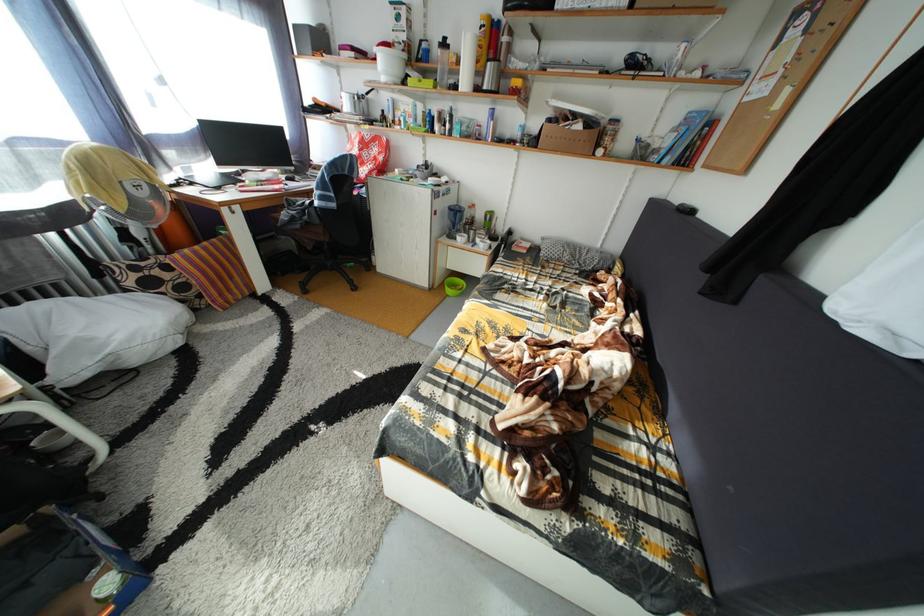
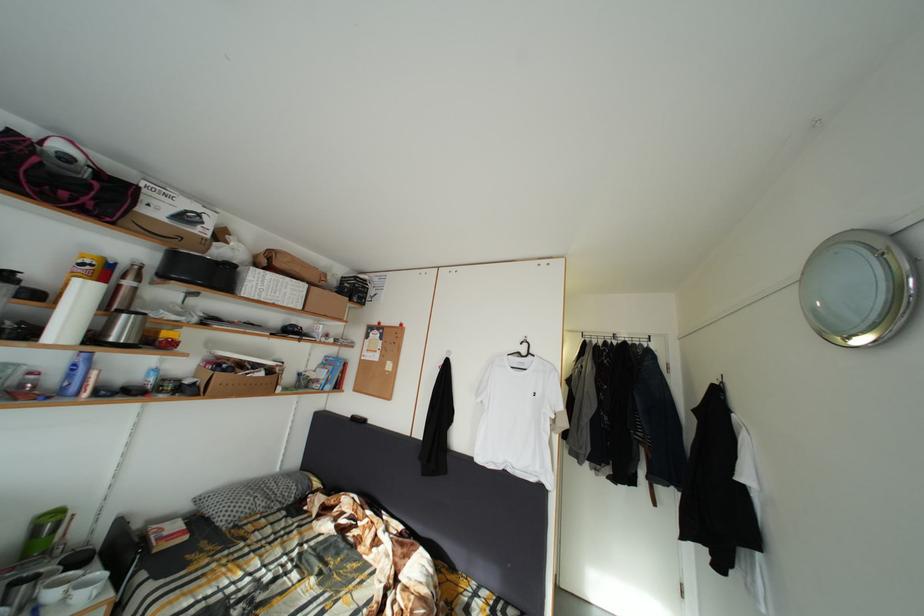
Locate, in the second image, the point that corresponds to [490,34] in the first image.

(91, 270)